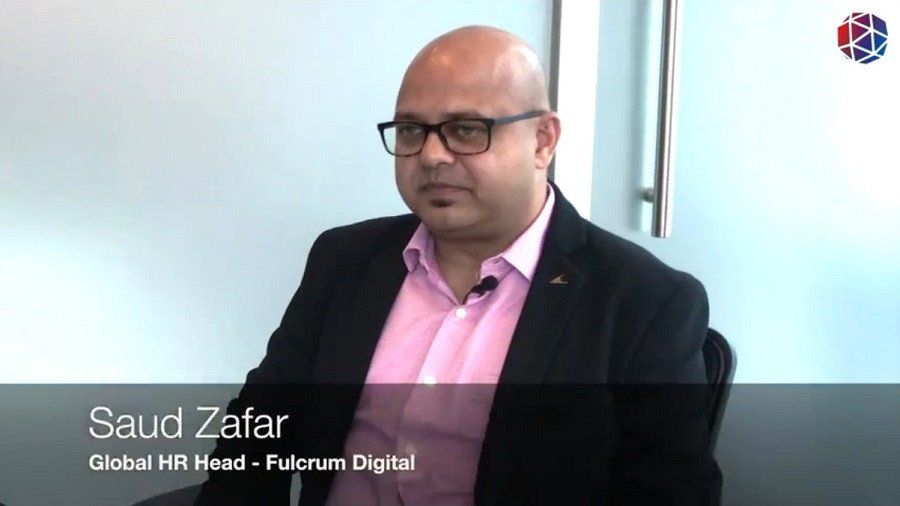
This screenshot has height=506, width=900. I want to click on door handle, so click(x=669, y=132).